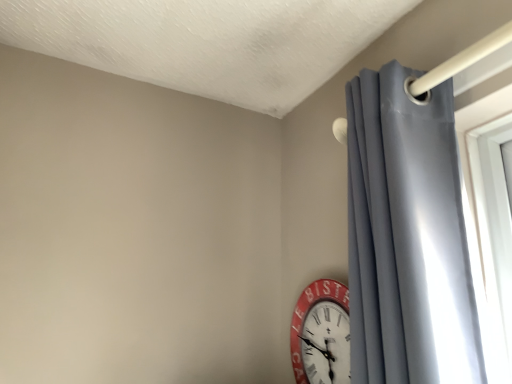
Describe the element at coordinates (408, 238) in the screenshot. I see `matte gray curtain at right` at that location.

Looking at this image, measure the distance between matte gray curtain at right and camera.

22.12 inches.

The height and width of the screenshot is (384, 512). In order to click on matte gray curtain at right in this screenshot , I will do `click(408, 238)`.

Locate an element on the screen. Image resolution: width=512 pixels, height=384 pixels. matte gray curtain at right is located at coordinates (408, 238).